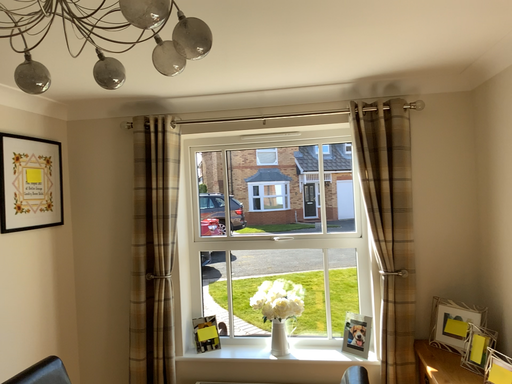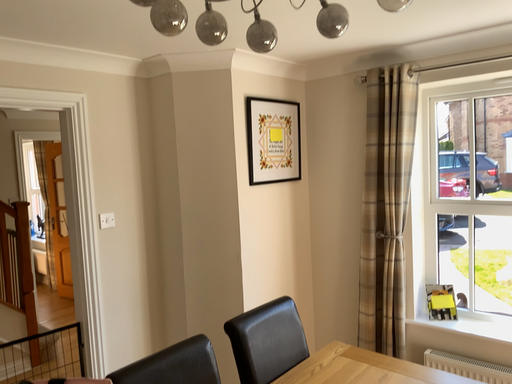
Question: How did the camera likely rotate when shooting the video?

Choices:
 (A) rotated left
 (B) rotated right

Answer: (A)